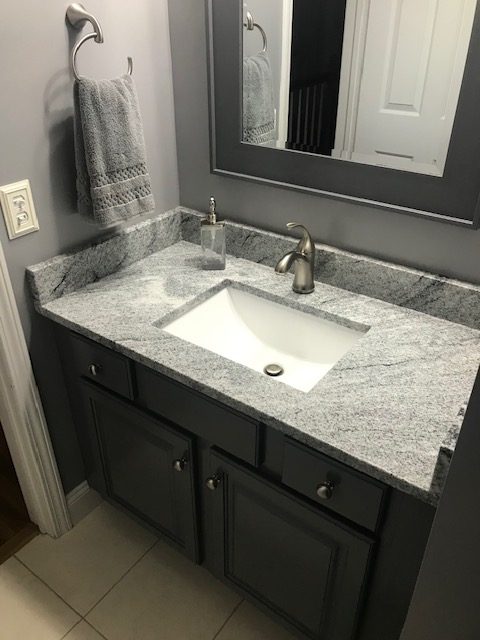
Where is `mirror`? Image resolution: width=480 pixels, height=640 pixels. mirror is located at coordinates (344, 147).